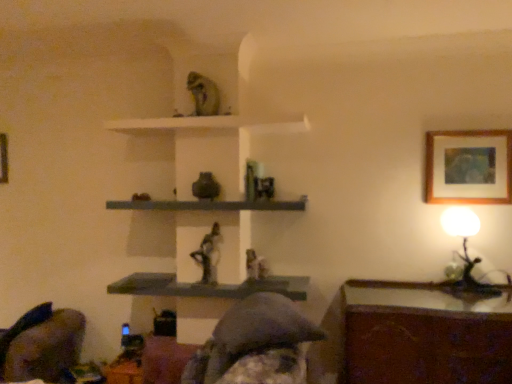
Describe the element at coordinates (255, 344) in the screenshot. This screenshot has height=384, width=512. I see `matte gray statue at center, the 3th person when ordered from back to front` at that location.

Identify the location of white matte shelf at upper center, arranged as the 1th shelf when viewed from the top. (216, 123).

What do you see at coordinates (468, 167) in the screenshot? I see `wooden framed artwork at upper right, the first picture frame from the right` at bounding box center [468, 167].

Describe the element at coordinates (255, 266) in the screenshot. I see `matte gray statue at center, which ranks as the 3th person in front-to-back order` at that location.

At what (x,y) coordinates should I click in order to perform the action: click on matte gray statue at center, the 3th person when ordered from back to front. Please return your answer as a coordinate pair (x, y). Image resolution: width=512 pixels, height=384 pixels. Looking at the image, I should click on (255, 344).

From the image's perspective, is matte gray shelf at center, positioned as the first shelf in bottom-to-top order, located above velvet dark gray swivel chair at lower left?

Correct, matte gray shelf at center, positioned as the first shelf in bottom-to-top order, appears higher than velvet dark gray swivel chair at lower left in the image.

Can you confirm if matte gray shelf at center, the 3th shelf when ordered from top to bottom, is smaller than velvet dark gray swivel chair at lower left?

Yes, matte gray shelf at center, the 3th shelf when ordered from top to bottom, is smaller than velvet dark gray swivel chair at lower left.

Considering the points (118, 287) and (45, 327), which point is behind, point (118, 287) or point (45, 327)?

The point (118, 287) is behind.

Between white glossy table lamp at right and wooden table at lower right, which one has larger width?

wooden table at lower right is wider.

Considering the relative sizes of white glossy table lamp at right and wooden table at lower right in the image provided, is white glossy table lamp at right taller than wooden table at lower right?

No.

Between white glossy table lamp at right and wooden table at lower right, which one has smaller size?

With smaller size is white glossy table lamp at right.

Locate an element on the screen. The height and width of the screenshot is (384, 512). table lying on the left of white glossy table lamp at right is located at coordinates (422, 341).

From a real-world perspective, which object rests below the other?

From a 3D spatial view, velvet dark gray swivel chair at lower left is below.

Is matte gray statue at center, placed as the second person when sorted from back to front, not close to velvet dark gray swivel chair at lower left?

Absolutely, matte gray statue at center, placed as the second person when sorted from back to front, is distant from velvet dark gray swivel chair at lower left.

From the image's perspective, is matte gray statue at center, placed as the second person when sorted from back to front, beneath velvet dark gray swivel chair at lower left?

No, from the image's perspective, matte gray statue at center, placed as the second person when sorted from back to front, is not beneath velvet dark gray swivel chair at lower left.

Considering the relative sizes of white glossy table lamp at right and wooden framed artwork at upper right, which ranks as the second picture frame in left-to-right order, in the image provided, is white glossy table lamp at right taller than wooden framed artwork at upper right, which ranks as the second picture frame in left-to-right order,?

Indeed, white glossy table lamp at right has a greater height compared to wooden framed artwork at upper right, which ranks as the second picture frame in left-to-right order.

From a real-world perspective, is white glossy table lamp at right on top of wooden framed artwork at upper right, which ranks as the second picture frame in back-to-front order?

No.

Is white glossy table lamp at right positioned beyond the bounds of wooden framed artwork at upper right, which ranks as the second picture frame in left-to-right order?

That's correct, white glossy table lamp at right is outside of wooden framed artwork at upper right, which ranks as the second picture frame in left-to-right order.

How many degrees apart are the facing directions of white glossy table lamp at right and wooden framed artwork at upper right, positioned as the 1th picture frame in front-to-back order?

white glossy table lamp at right and wooden framed artwork at upper right, positioned as the 1th picture frame in front-to-back order, are facing 1.99 degrees away from each other.

Is wooden table at lower right not within white glossy table lamp at right?

Indeed, wooden table at lower right is completely outside white glossy table lamp at right.

In terms of size, does wooden table at lower right appear bigger or smaller than white glossy table lamp at right?

Considering their sizes, wooden table at lower right takes up more space than white glossy table lamp at right.

This screenshot has width=512, height=384. I want to click on table lamp on the right of wooden table at lower right, so click(464, 239).

Which of these two, wooden table at lower right or white glossy table lamp at right, is wider?

wooden table at lower right.

Is white matte shelf at upper center, marked as the 3th shelf in a bottom-to-top arrangement, further to camera compared to matte gray statue at center, positioned as the first person in front-to-back order?

That is True.

Is there a large distance between white matte shelf at upper center, marked as the 3th shelf in a bottom-to-top arrangement, and matte gray statue at center, the 3th person when ordered from back to front?

Yes, white matte shelf at upper center, marked as the 3th shelf in a bottom-to-top arrangement, and matte gray statue at center, the 3th person when ordered from back to front, are located far from each other.

Which of these two, white matte shelf at upper center, marked as the 3th shelf in a bottom-to-top arrangement, or matte gray statue at center, the 3th person when ordered from back to front, is smaller?

Smaller between the two is white matte shelf at upper center, marked as the 3th shelf in a bottom-to-top arrangement.

Does white glossy table lamp at right have a greater height compared to wooden picture frame at upper left, the first picture frame in the back-to-front sequence?

Yes, white glossy table lamp at right is taller than wooden picture frame at upper left, the first picture frame in the back-to-front sequence.

Is white glossy table lamp at right oriented towards wooden picture frame at upper left, the first picture frame positioned from the left?

No, white glossy table lamp at right is not aimed at wooden picture frame at upper left, the first picture frame positioned from the left.

Considering the relative sizes of white glossy table lamp at right and wooden picture frame at upper left, acting as the second picture frame starting from the front, in the image provided, is white glossy table lamp at right thinner than wooden picture frame at upper left, acting as the second picture frame starting from the front,?

No, white glossy table lamp at right is not thinner than wooden picture frame at upper left, acting as the second picture frame starting from the front.

From the image's perspective, is white glossy table lamp at right above or below wooden picture frame at upper left, the first picture frame positioned from the left?

Based on their image positions, white glossy table lamp at right is located beneath wooden picture frame at upper left, the first picture frame positioned from the left.

This screenshot has height=384, width=512. Find the location of `swivel chair behind the matte gray shelf at center, positioned as the first shelf in bottom-to-top order`. swivel chair behind the matte gray shelf at center, positioned as the first shelf in bottom-to-top order is located at coordinates (42, 345).

Identify the location of table that is in front of the white glossy table lamp at right. The width and height of the screenshot is (512, 384). (422, 341).

When comparing their distances from matte gray shelf at center, the 3th shelf when ordered from top to bottom, does white matte shelf at upper center, arranged as the 1th shelf when viewed from the top, or matte gray statue at center, the 3th person when ordered from back to front, seem further?

Based on the image, white matte shelf at upper center, arranged as the 1th shelf when viewed from the top, appears to be further to matte gray shelf at center, the 3th shelf when ordered from top to bottom.

Looking at the image, which one is located closer to velvet dark gray swivel chair at lower left, matte gray statue at center, the 3th person when ordered from back to front, or wooden picture frame at upper left, positioned as the second picture frame in right-to-left order?

Among the two, wooden picture frame at upper left, positioned as the second picture frame in right-to-left order, is located nearer to velvet dark gray swivel chair at lower left.

Based on their spatial positions, is wooden picture frame at upper left, acting as the second picture frame starting from the front, or matte gray shelf at center, the 3th shelf when ordered from top to bottom, closer to velvet dark gray swivel chair at lower left?

Among the two, matte gray shelf at center, the 3th shelf when ordered from top to bottom, is located nearer to velvet dark gray swivel chair at lower left.

Considering their positions, is matte gray statue at center, placed as the first person when sorted from back to front, positioned closer to white matte shelf at upper center, arranged as the 1th shelf when viewed from the top, than matte gray statue at center, placed as the second person when sorted from back to front?

matte gray statue at center, placed as the second person when sorted from back to front, lies closer to white matte shelf at upper center, arranged as the 1th shelf when viewed from the top, than the other object.

Based on their spatial positions, is matte gray statue at center, the 3th person when ordered from back to front, or matte gray statue at center, which ranks as the 3th person in front-to-back order, further from matte gray shelf at center, the 3th shelf when ordered from top to bottom?

The object further to matte gray shelf at center, the 3th shelf when ordered from top to bottom, is matte gray statue at center, the 3th person when ordered from back to front.

When comparing their distances from wooden framed artwork at upper right, the first picture frame from the right, does matte gray shelf at center, the 3th shelf when ordered from top to bottom, or wooden table at lower right seem closer?

Among the two, wooden table at lower right is located nearer to wooden framed artwork at upper right, the first picture frame from the right.

Based on their spatial positions, is matte gray shelf at center, positioned as the first shelf in bottom-to-top order, or white matte shelf at upper center, arranged as the 1th shelf when viewed from the top, further from wooden table at lower right?

white matte shelf at upper center, arranged as the 1th shelf when viewed from the top, is positioned further to the anchor wooden table at lower right.

Considering their positions, is matte gray shelf at center, positioned as the first shelf in bottom-to-top order, positioned further to wooden table at lower right than wooden picture frame at upper left, positioned as the second picture frame in right-to-left order?

wooden picture frame at upper left, positioned as the second picture frame in right-to-left order, lies further to wooden table at lower right than the other object.

You are a GUI agent. You are given a task and a screenshot of the screen. Output one action in this format:
    pyautogui.click(x=<x>, y=<y>)
    Task: Click on the table between matte gray shelf at center, positioned as the first shelf in bottom-to-top order, and wooden framed artwork at upper right, which ranks as the second picture frame in back-to-front order, in the horizontal direction
    This screenshot has height=384, width=512.
    Given the screenshot: What is the action you would take?
    pyautogui.click(x=422, y=341)

I want to click on person between matte gray statue at center, placed as the first person when sorted from back to front, and white glossy table lamp at right, in the horizontal direction, so click(x=255, y=344).

At what (x,y) coordinates should I click in order to perform the action: click on table between wooden picture frame at upper left, positioned as the second picture frame in right-to-left order, and white glossy table lamp at right, in the horizontal direction. Please return your answer as a coordinate pair (x, y). Looking at the image, I should click on (422, 341).

Where is `person between smooth gray shelf at center, placed as the second shelf when sorted from bottom to top, and matte gray statue at center, placed as the first person when sorted from back to front, vertically`? This screenshot has height=384, width=512. person between smooth gray shelf at center, placed as the second shelf when sorted from bottom to top, and matte gray statue at center, placed as the first person when sorted from back to front, vertically is located at coordinates (207, 254).